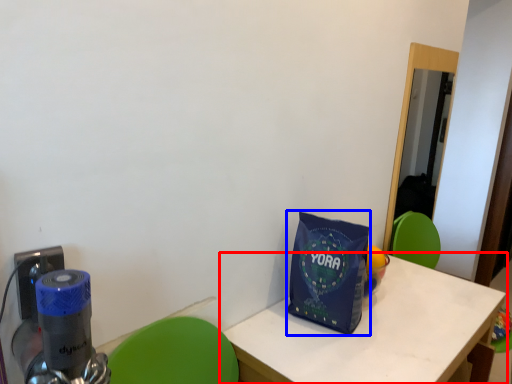
Question: Which object appears farthest to the camera in this image, table (highlighted by a red box) or tote bag (highlighted by a blue box)?

Choices:
 (A) table
 (B) tote bag

Answer: (B)